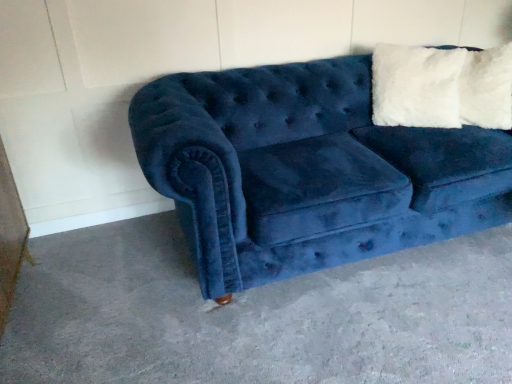
Question: From their relative heights in the image, would you say velvet blue couch at center is taller or shorter than blue velvet couch at lower right?

Choices:
 (A) tall
 (B) short

Answer: (A)

Question: Is velvet blue couch at center inside or outside of blue velvet couch at lower right?

Choices:
 (A) inside
 (B) outside

Answer: (B)

Question: From a real-world perspective, is velvet blue couch at center physically located above or below blue velvet couch at lower right?

Choices:
 (A) below
 (B) above

Answer: (B)

Question: Would you say blue velvet couch at lower right is inside or outside velvet blue couch at center?

Choices:
 (A) inside
 (B) outside

Answer: (B)

Question: Considering their positions, is blue velvet couch at lower right located in front of or behind velvet blue couch at center?

Choices:
 (A) behind
 (B) front

Answer: (B)

Question: Based on their positions, is blue velvet couch at lower right located to the left or right of velvet blue couch at center?

Choices:
 (A) right
 (B) left

Answer: (B)

Question: From the image's perspective, is blue velvet couch at lower right above or below velvet blue couch at center?

Choices:
 (A) above
 (B) below

Answer: (B)